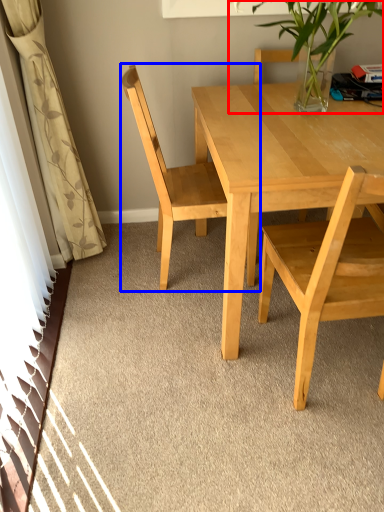
Question: Which object is closer to the camera taking this photo, houseplant (highlighted by a red box) or chair (highlighted by a blue box)?

Choices:
 (A) houseplant
 (B) chair

Answer: (A)